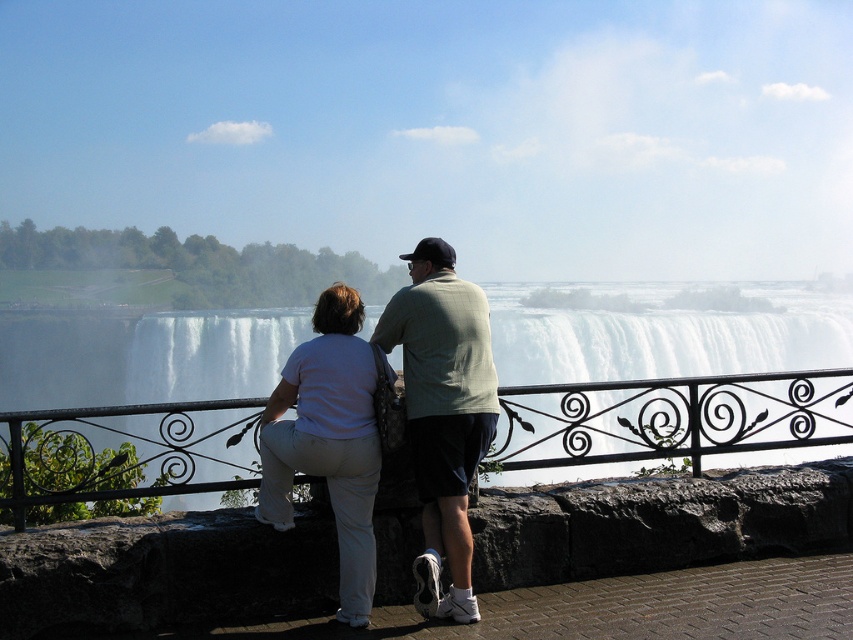
Question: Which point is farther from the camera taking this photo?

Choices:
 (A) (650, 388)
 (B) (296, 422)
 (C) (641, 417)

Answer: (A)

Question: Does black wrought iron railing at center have a smaller size compared to white frothy water at center?

Choices:
 (A) yes
 (B) no

Answer: (A)

Question: Considering the relative positions of black wrought iron railing at center and white frothy water at center in the image provided, where is black wrought iron railing at center located with respect to white frothy water at center?

Choices:
 (A) above
 (B) below

Answer: (B)

Question: Which point is closer to the camera taking this photo?

Choices:
 (A) (581, 432)
 (B) (474, 422)
 (C) (178, 401)

Answer: (B)

Question: From the image, what is the correct spatial relationship of black wrought iron railing at center in relation to white frothy water at center?

Choices:
 (A) left
 (B) right

Answer: (A)

Question: Which object is farther from the camera taking this photo?

Choices:
 (A) white frothy water at center
 (B) white cotton pants at center

Answer: (A)